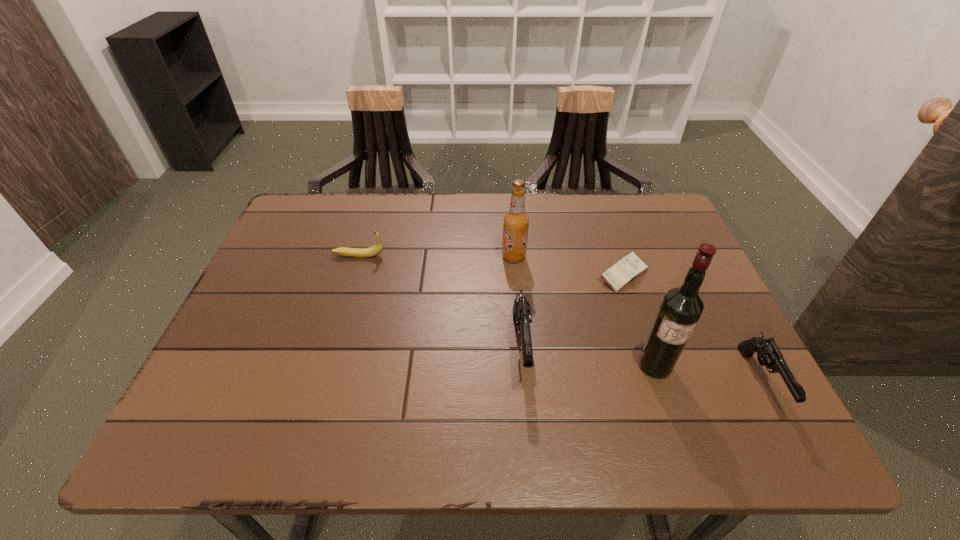
You are a GUI agent. You are given a task and a screenshot of the screen. Output one action in this format:
    pyautogui.click(x=<x>, y=<y>)
    Task: Click on the free space at the near edge
    This screenshot has width=960, height=540.
    Given the screenshot: What is the action you would take?
    pyautogui.click(x=408, y=388)

Find the location of `vacant space at the left edge of the desktop`. vacant space at the left edge of the desktop is located at coordinates (329, 254).

At what (x,y) coordinates should I click in order to perform the action: click on free region at the right edge. Please return your answer as a coordinate pair (x, y). The image size is (960, 540). Looking at the image, I should click on (670, 274).

This screenshot has height=540, width=960. What are the coordinates of `vacant space at the far right corner of the desktop` in the screenshot? It's located at (676, 242).

Find the location of a particular element. blank region between the fifth shortest object and the right gun is located at coordinates (636, 319).

You are a GUI agent. You are given a task and a screenshot of the screen. Output one action in this format:
    pyautogui.click(x=<x>, y=<y>)
    Task: Click on the empty location between the tallest object and the leftmost object
    
    Given the screenshot: What is the action you would take?
    pyautogui.click(x=507, y=310)

Image resolution: width=960 pixels, height=540 pixels. In order to click on empty location between the shorter gun and the banana in this screenshot , I will do `click(560, 319)`.

You are a GUI agent. You are given a task and a screenshot of the screen. Output one action in this format:
    pyautogui.click(x=<x>, y=<y>)
    Task: Click on the vacant space that's between the tallest object and the diary
    
    Given the screenshot: What is the action you would take?
    pyautogui.click(x=639, y=320)

Where is `free space between the shorter gun and the tallest object`? This screenshot has width=960, height=540. free space between the shorter gun and the tallest object is located at coordinates [x=708, y=374].

This screenshot has width=960, height=540. Find the location of `vacant point located between the beer bottle and the wine bottle`. vacant point located between the beer bottle and the wine bottle is located at coordinates (585, 311).